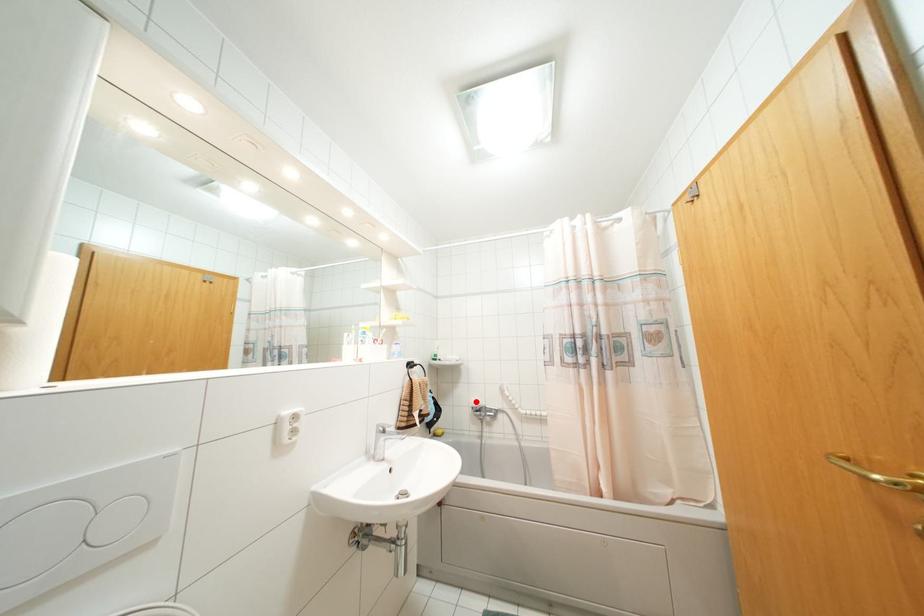
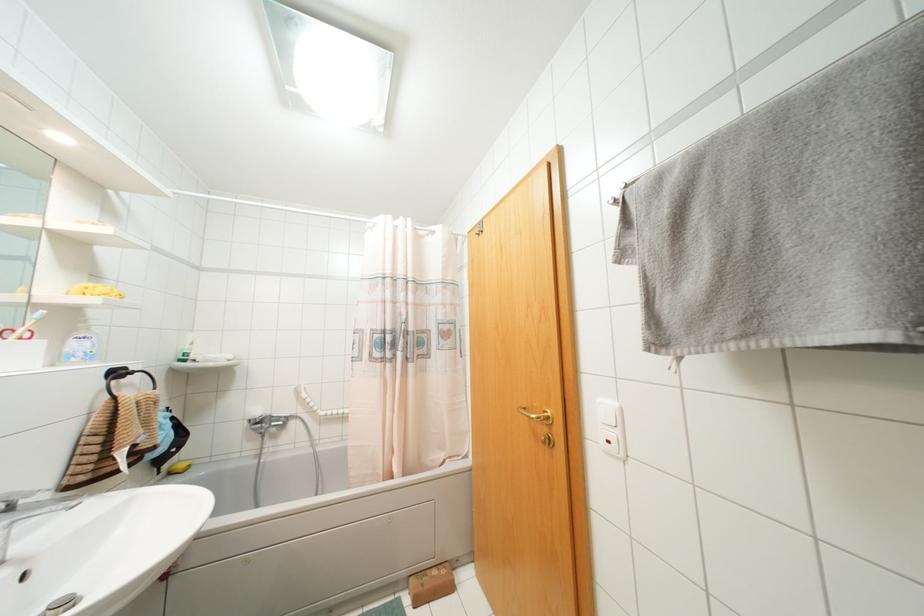
Find the pixel in the second image that matches the highlighted location in the first image.

(258, 411)